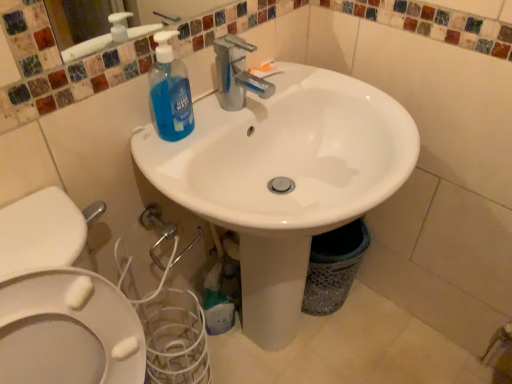
Question: Considering the relative sizes of blue translucent liquid soap at upper left, the 2th cleaning product ordered from the bottom, and translucent plastic bottle at lower center, the first cleaning product when ordered from bottom to top, in the image provided, is blue translucent liquid soap at upper left, the 2th cleaning product ordered from the bottom, wider than translucent plastic bottle at lower center, the first cleaning product when ordered from bottom to top,?

Choices:
 (A) yes
 (B) no

Answer: (B)

Question: Is blue translucent liquid soap at upper left, which ranks as the first cleaning product in front-to-back order, completely or partially outside of translucent plastic bottle at lower center, positioned as the 2th cleaning product in front-to-back order?

Choices:
 (A) no
 (B) yes

Answer: (B)

Question: From a real-world perspective, is blue translucent liquid soap at upper left, placed as the 2th cleaning product when sorted from back to front, below translucent plastic bottle at lower center, arranged as the 1th cleaning product when viewed from the back?

Choices:
 (A) no
 (B) yes

Answer: (A)

Question: Is translucent plastic bottle at lower center, arranged as the 1th cleaning product when viewed from the back, completely or partially inside blue translucent liquid soap at upper left, positioned as the first cleaning product in top-to-bottom order?

Choices:
 (A) no
 (B) yes

Answer: (A)

Question: Is translucent plastic bottle at lower center, acting as the 2th cleaning product starting from the top, at the back of blue translucent liquid soap at upper left, placed as the 2th cleaning product when sorted from back to front?

Choices:
 (A) no
 (B) yes

Answer: (A)

Question: From a real-world perspective, is blue translucent liquid soap at upper left, the 2th cleaning product ordered from the bottom, on translucent plastic bottle at lower center, positioned as the 2th cleaning product in front-to-back order?

Choices:
 (A) yes
 (B) no

Answer: (A)

Question: Is white glossy sink at center not within blue translucent liquid soap at upper left, placed as the 2th cleaning product when sorted from back to front?

Choices:
 (A) yes
 (B) no

Answer: (A)

Question: Considering the relative sizes of white glossy sink at center and blue translucent liquid soap at upper left, placed as the 2th cleaning product when sorted from back to front, in the image provided, is white glossy sink at center shorter than blue translucent liquid soap at upper left, placed as the 2th cleaning product when sorted from back to front,?

Choices:
 (A) no
 (B) yes

Answer: (A)

Question: Can you confirm if white glossy sink at center is taller than blue translucent liquid soap at upper left, which ranks as the first cleaning product in front-to-back order?

Choices:
 (A) no
 (B) yes

Answer: (B)

Question: Does white glossy sink at center have a lesser width compared to blue translucent liquid soap at upper left, placed as the 2th cleaning product when sorted from back to front?

Choices:
 (A) yes
 (B) no

Answer: (B)

Question: Is blue translucent liquid soap at upper left, positioned as the first cleaning product in top-to-bottom order, at the back of white glossy sink at center?

Choices:
 (A) yes
 (B) no

Answer: (A)

Question: Is white glossy sink at center oriented towards blue translucent liquid soap at upper left, the 2th cleaning product ordered from the bottom?

Choices:
 (A) yes
 (B) no

Answer: (B)

Question: Is translucent plastic bottle at lower center, arranged as the 1th cleaning product when viewed from the back, further to camera compared to blue translucent liquid soap at upper left, which ranks as the first cleaning product in front-to-back order?

Choices:
 (A) yes
 (B) no

Answer: (A)